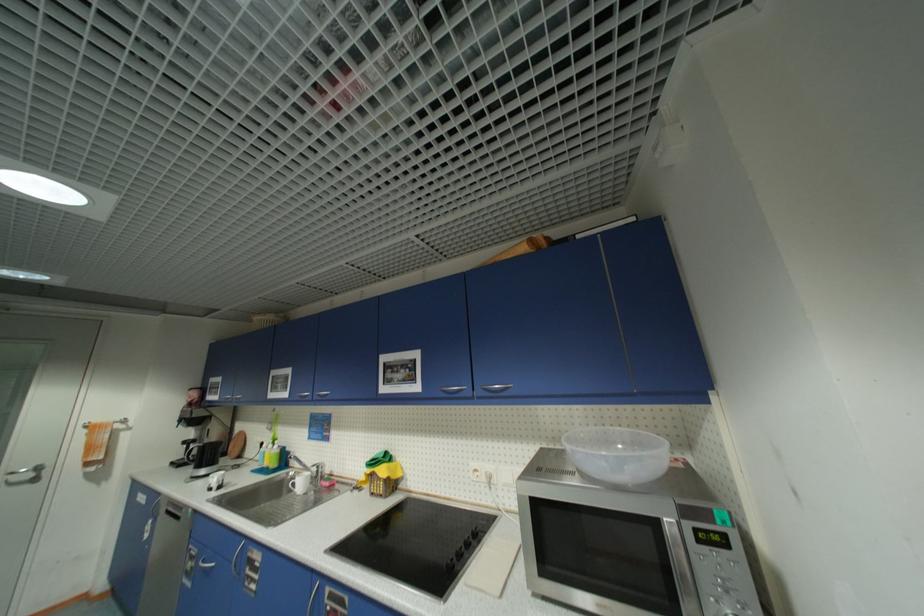
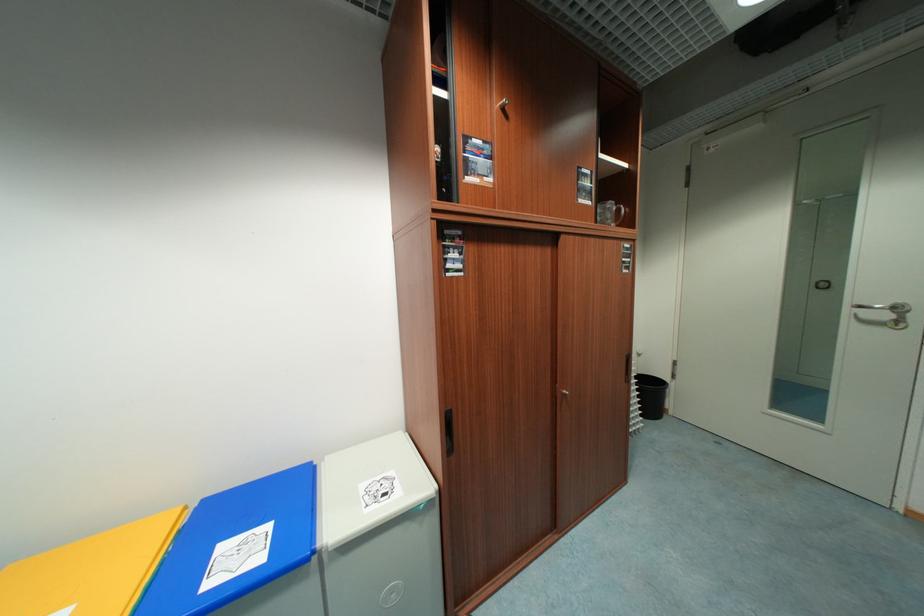
In the second image, find the point that corresponds to (44,469) in the first image.

(904, 310)